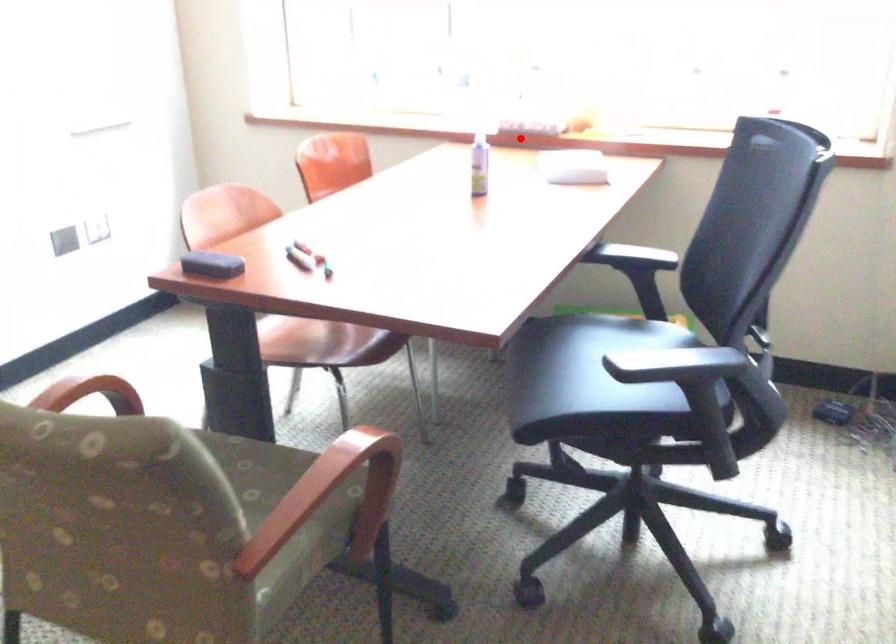
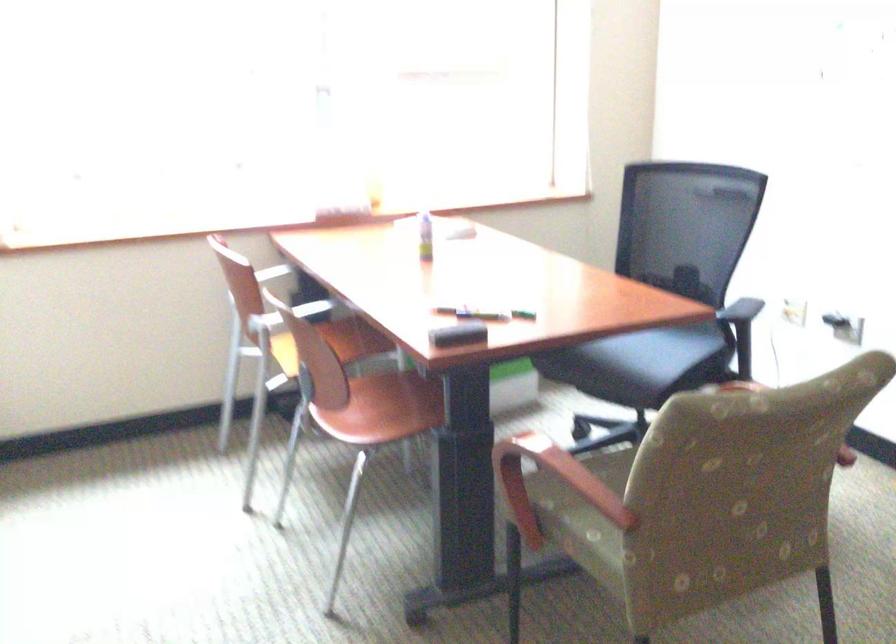
Question: I am providing you with two images of the same scene from different viewpoints. A red point is shown in image1. For the corresponding object point in image2, is it positioned nearer or farther from the camera?

Choices:
 (A) Nearer
 (B) Farther

Answer: (B)